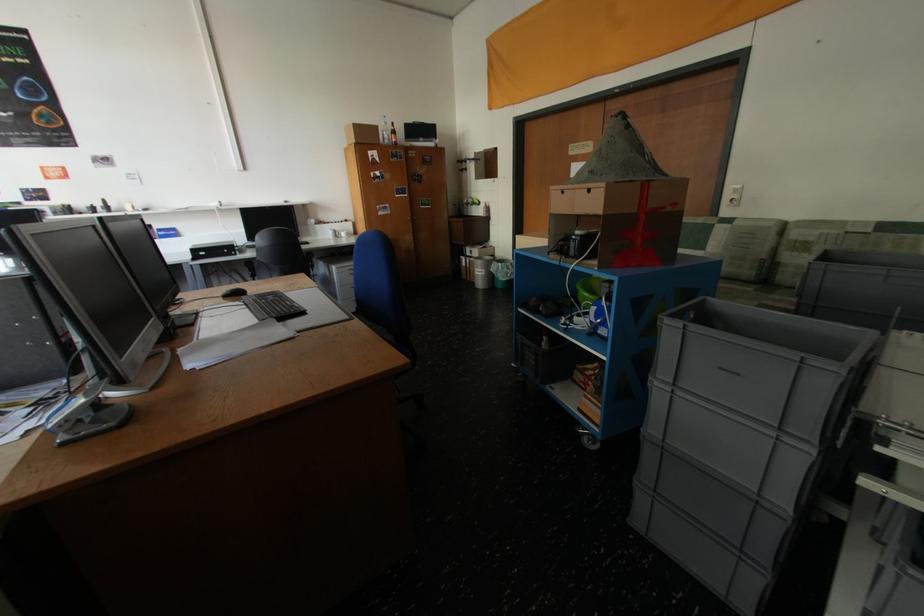
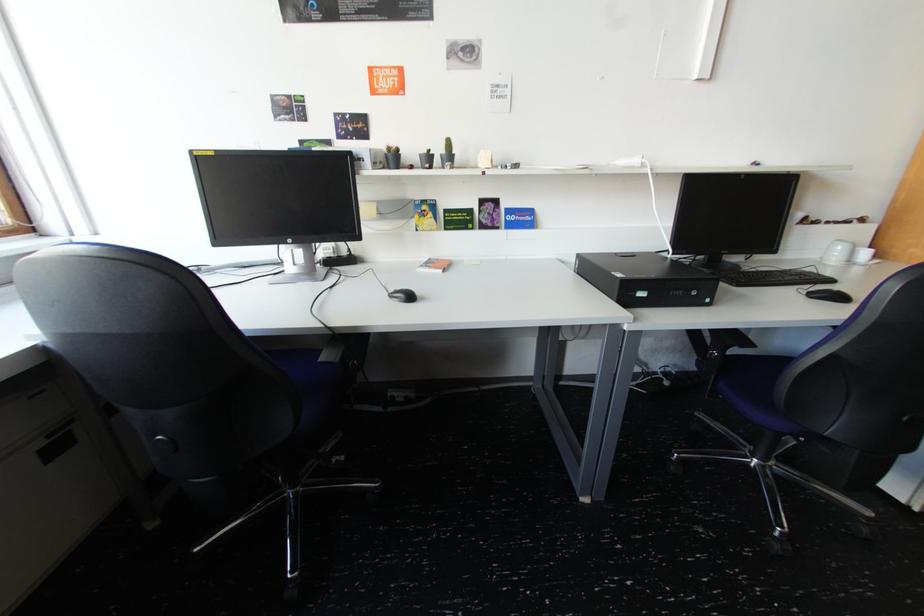
Where in the second image is the point corresponding to (x=111, y=206) from the first image?

(452, 152)